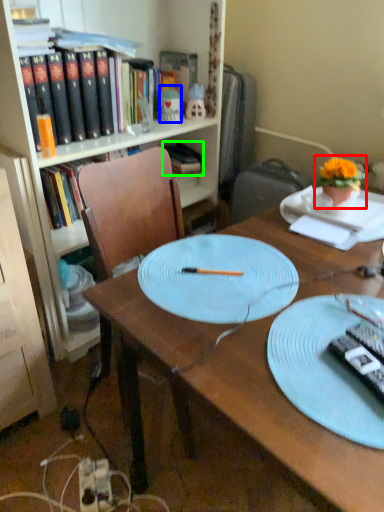
Question: Which object is positioned closest to houseplant (highlighted by a red box)? Select from toy (highlighted by a blue box) and book (highlighted by a green box).

Choices:
 (A) toy
 (B) book

Answer: (A)